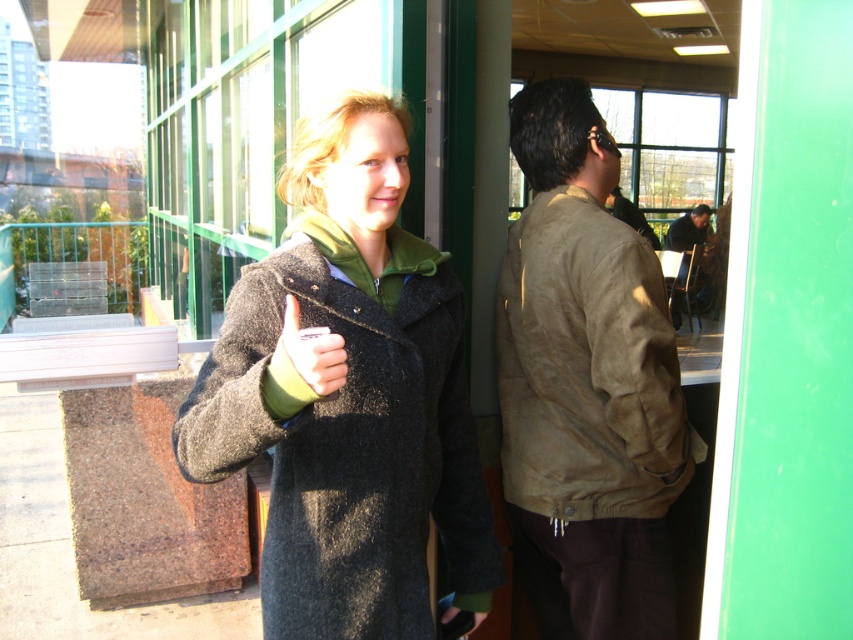
Question: Which object is farther from the camera taking this photo?

Choices:
 (A) brown suede jacket at right
 (B) dark gray wool coat at center

Answer: (A)

Question: Does dark gray wool coat at center appear over brown suede jacket at right?

Choices:
 (A) yes
 (B) no

Answer: (B)

Question: Is dark gray wool coat at center bigger than brown suede jacket at right?

Choices:
 (A) no
 (B) yes

Answer: (B)

Question: In this image, where is dark gray wool coat at center located relative to brown suede jacket at right?

Choices:
 (A) above
 (B) below

Answer: (B)

Question: Which point is closer to the camera?

Choices:
 (A) dark gray wool coat at center
 (B) brown suede jacket at right

Answer: (A)